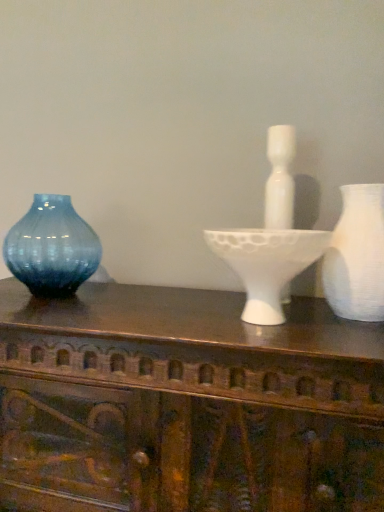
Question: Is white matte vase at right, which ranks as the first vase in front-to-back order, in front of or behind blue glass vase at left, acting as the first vase starting from the left, in the image?

Choices:
 (A) behind
 (B) front

Answer: (B)

Question: Is white matte vase at right, the 2th vase when ordered from back to front, wider or thinner than blue glass vase at left, acting as the first vase starting from the left?

Choices:
 (A) wide
 (B) thin

Answer: (A)

Question: Which of these objects is positioned farthest from the white matte candle holder at center?

Choices:
 (A) white matte vase at right, the 2th vase when ordered from back to front
 (B) wooden carved table at center
 (C) blue glass vase at left, the first vase viewed from the back

Answer: (C)

Question: Estimate the real-world distances between objects in this image. Which object is closer to the wooden carved table at center?

Choices:
 (A) white matte vase at right, which ranks as the first vase in front-to-back order
 (B) white matte candle holder at center
 (C) blue glass vase at left, acting as the first vase starting from the left

Answer: (B)